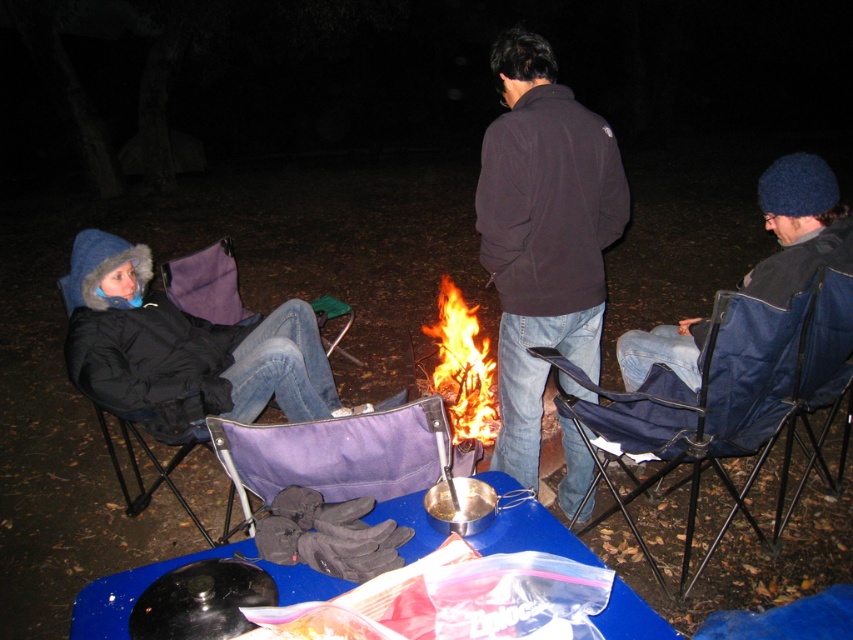
You are standing at the center of the campfire and want to move to the blue fabric chair at right. Which direction should you walk to reach it?

The blue fabric chair at right is located at point 0.586 on the x and 0.889 on the y coordinate, so you should walk to the right and slightly forward to reach it.

You are trying to decide whether to sit on the black padded chair at left or the dark fleece jacket at center. Which one is more appropriate to sit on?

The black padded chair at left is more appropriate to sit on because the dark fleece jacket at center is positioned over it, likely placed there as a seat cushion or added comfort.

You are a hiker who just arrived at the campsite and want to sit as close as possible to the flamewoodenbonfire at center without burning yourself. The recommended safe distance from a campfire is at least 36 inches. Is the black fuzzy hat at left within the safe distance?

The black fuzzy hat at left is 38.00 inches away from the flamewoodenbonfire at center, which is just beyond the recommended safe distance of 36 inches. Therefore, it is within the safe range.